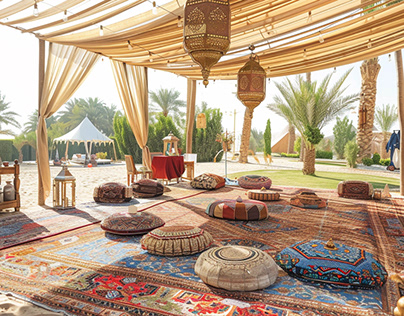
Where is `table`? table is located at coordinates (171, 164), (2, 170).